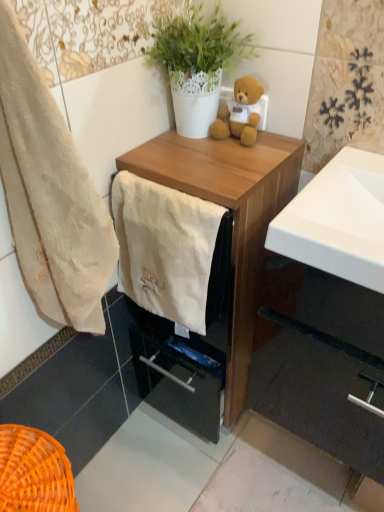
Question: In the image, is beige cotton towel at left, which is counted as the 2th towel/napkin, starting from the right, positioned in front of or behind soft plush teddy bear at upper center?

Choices:
 (A) behind
 (B) front

Answer: (B)

Question: Do you think beige cotton towel at left, which appears as the 1th towel/napkin when viewed from the left, is within soft plush teddy bear at upper center, or outside of it?

Choices:
 (A) inside
 (B) outside

Answer: (B)

Question: Based on their relative distances, which object is farther from the white glossy sink at center right?

Choices:
 (A) soft plush teddy bear at upper center
 (B) white textured pot at upper center
 (C) wooden chest of drawers at center
 (D) beige cotton towel at left, which appears as the 1th towel/napkin when viewed from the left
 (E) matte wood cabinet at lower right

Answer: (E)

Question: Estimate the real-world distances between objects in this image. Which object is closer to the matte wood cabinet at lower right?

Choices:
 (A) white soft towel at center, which is the 2th towel/napkin from left to right
 (B) soft plush teddy bear at upper center
 (C) wooden chest of drawers at center
 (D) white glossy sink at center right
 (E) beige cotton towel at left, which is counted as the 2th towel/napkin, starting from the right

Answer: (C)